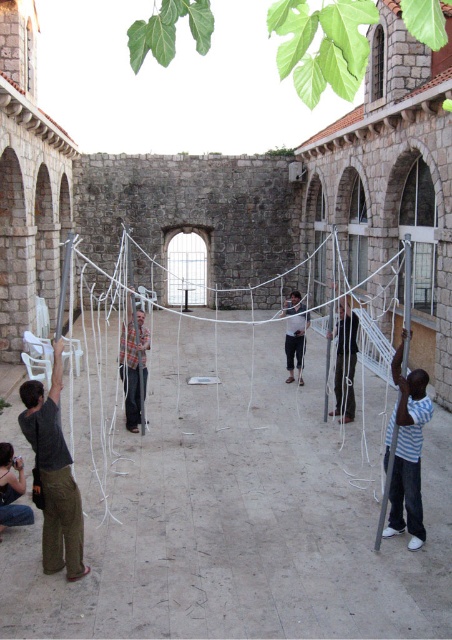
Question: Can you confirm if dark gray fabric at center is bigger than denim jeans at lower left?

Choices:
 (A) no
 (B) yes

Answer: (B)

Question: Observing the image, what is the correct spatial positioning of striped shirt at right in reference to denim jeans at lower left?

Choices:
 (A) left
 (B) right

Answer: (B)

Question: Is the position of striped shirt at right less distant than that of plaid shirt at center?

Choices:
 (A) no
 (B) yes

Answer: (B)

Question: Among these objects, which one is farthest from the camera?

Choices:
 (A) dark gray shirt at left
 (B) denim jeans at lower left
 (C) plaid shirt at center
 (D) dark gray fabric at center

Answer: (D)

Question: Which object is the closest to the denim jeans at lower left?

Choices:
 (A) striped shirt at right
 (B) matte white shirt at center
 (C) white string net at center
 (D) dark gray shirt at left

Answer: (D)

Question: Which object is the closest to the matte white shirt at center?

Choices:
 (A) denim jeans at lower left
 (B) striped shirt at right
 (C) white string net at center

Answer: (C)